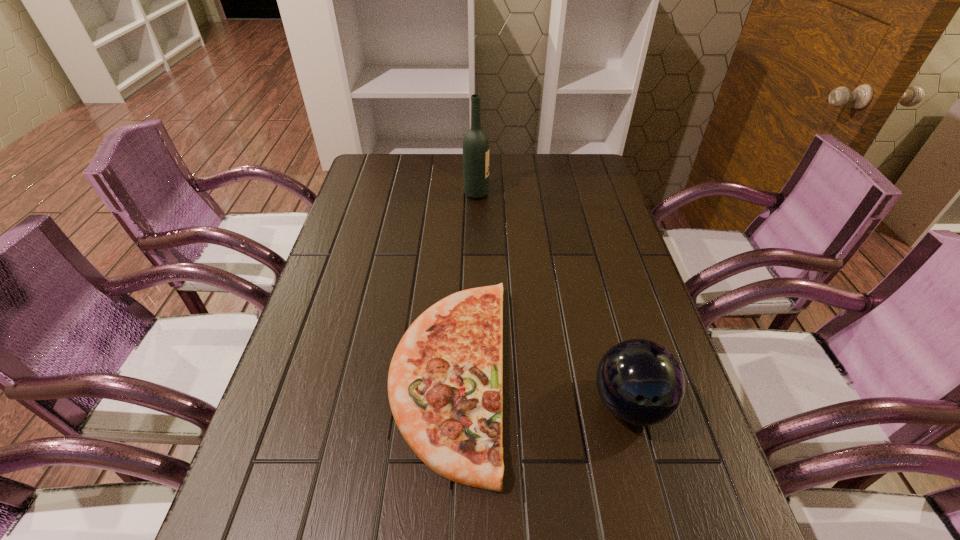
At what (x,y) coordinates should I click in order to perform the action: click on vacant point at the far edge. Please return your answer as a coordinate pair (x, y). Looking at the image, I should click on (527, 160).

Find the location of a particular element. The height and width of the screenshot is (540, 960). blank space at the left edge of the desktop is located at coordinates (327, 330).

What are the coordinates of `free point at the right edge` in the screenshot? It's located at (586, 215).

I want to click on free region at the far left corner, so click(x=403, y=170).

The width and height of the screenshot is (960, 540). In the image, there is a desktop. Identify the location of vacant area at the far right corner. (564, 187).

Locate an element on the screen. empty space between the pizza and the tallest object is located at coordinates (463, 283).

Identify the location of blank region between the pizza and the farthest object. (463, 283).

Image resolution: width=960 pixels, height=540 pixels. Find the location of `free area in between the second shortest object and the pizza`. free area in between the second shortest object and the pizza is located at coordinates (540, 388).

Identify the location of vacant space that's between the bowling ball and the farthest object. (553, 299).

Where is `blank region between the pizza and the tallest object`? This screenshot has width=960, height=540. blank region between the pizza and the tallest object is located at coordinates (463, 283).